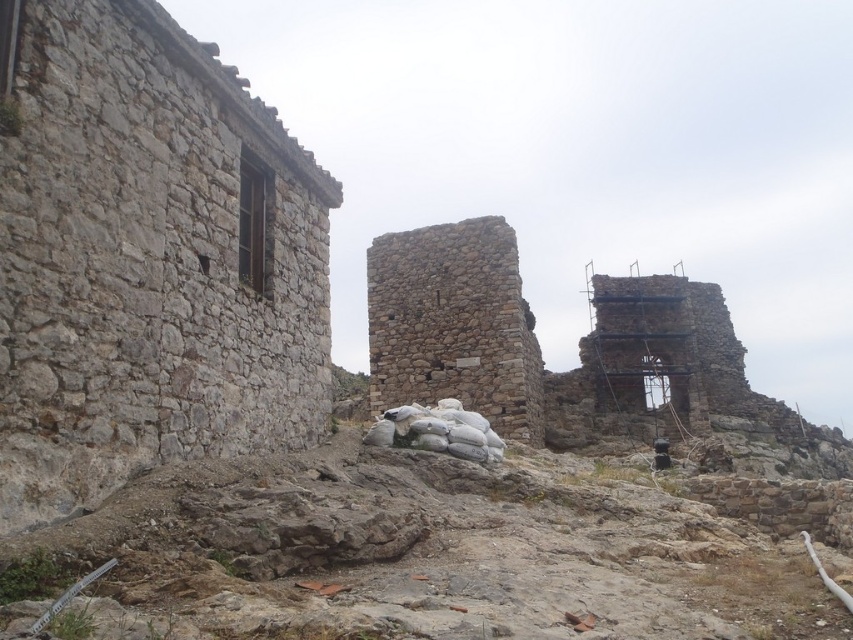
Between rough stone wall at left and rustic stone ruins at center, which one has less height?

With less height is rough stone wall at left.

From the picture: Can you confirm if rough stone wall at left is shorter than rustic stone ruins at center?

Correct, rough stone wall at left is not as tall as rustic stone ruins at center.

The width and height of the screenshot is (853, 640). What are the coordinates of `rough stone wall at left` in the screenshot? It's located at (148, 259).

Where is `rough stone wall at left`? This screenshot has height=640, width=853. rough stone wall at left is located at coordinates (148, 259).